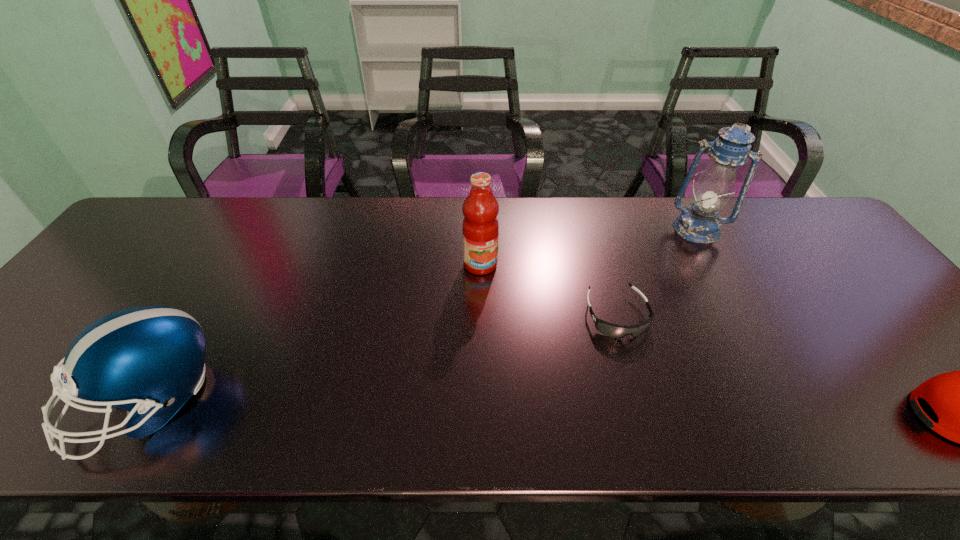
In order to click on the leftmost object in this screenshot , I will do `click(150, 360)`.

Identify the location of the third shortest object. The width and height of the screenshot is (960, 540). (150, 360).

Locate an element on the screen. The width and height of the screenshot is (960, 540). the second object from left to right is located at coordinates (480, 228).

The width and height of the screenshot is (960, 540). In order to click on the fourth shortest object in this screenshot , I will do `click(480, 228)`.

You are a GUI agent. You are given a task and a screenshot of the screen. Output one action in this format:
    pyautogui.click(x=<x>, y=<y>)
    Task: Click on the third farthest object
    The image size is (960, 540).
    Given the screenshot: What is the action you would take?
    pyautogui.click(x=615, y=331)

Where is `the shortest object`? This screenshot has width=960, height=540. the shortest object is located at coordinates (615, 331).

The height and width of the screenshot is (540, 960). I want to click on lantern, so click(x=700, y=223).

At what (x,y) coordinates should I click in order to perform the action: click on the tallest object. Please return your answer as a coordinate pair (x, y). The width and height of the screenshot is (960, 540). Looking at the image, I should click on (700, 223).

Find the location of a particular element. vacant region located 0.100m on the front label of the fourth nearest object is located at coordinates (506, 300).

Where is `free spot located on the front label of the fourth nearest object`? This screenshot has width=960, height=540. free spot located on the front label of the fourth nearest object is located at coordinates (544, 355).